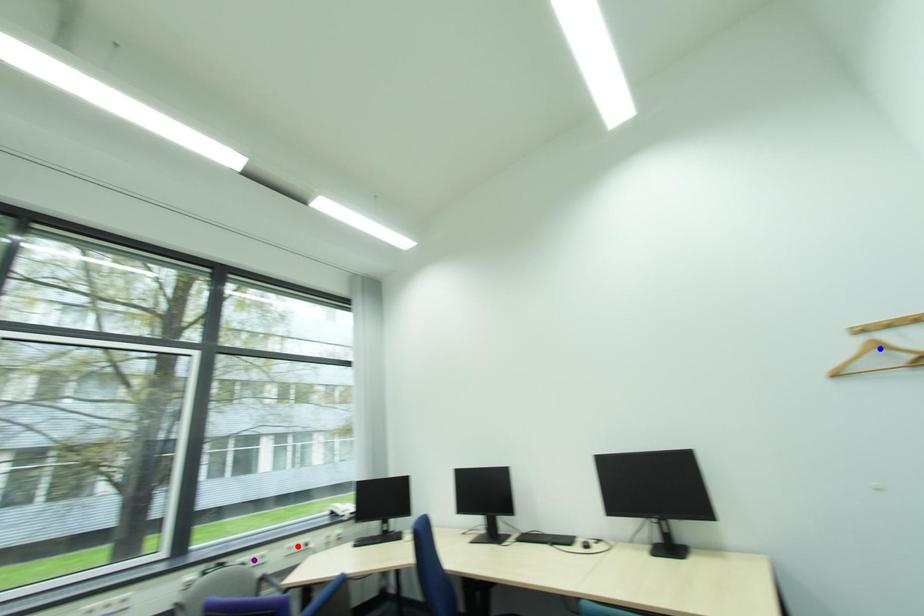
Order these from nearest to farthest:
1. blue point
2. purple point
3. red point

red point
purple point
blue point